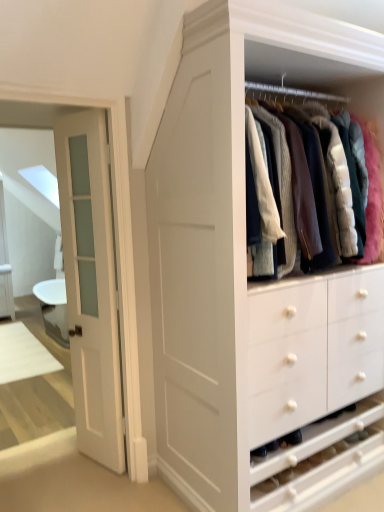
What do you see at coordinates (91, 284) in the screenshot?
I see `white glossy door at left` at bounding box center [91, 284].

Measure the distance between white glossy door at left and camera.

The distance of white glossy door at left from camera is 7.24 feet.

Identify the location of white glossy door at left. Image resolution: width=384 pixels, height=512 pixels. [x=91, y=284].

Where is `white glossy door at left`? The width and height of the screenshot is (384, 512). white glossy door at left is located at coordinates pyautogui.click(x=91, y=284).